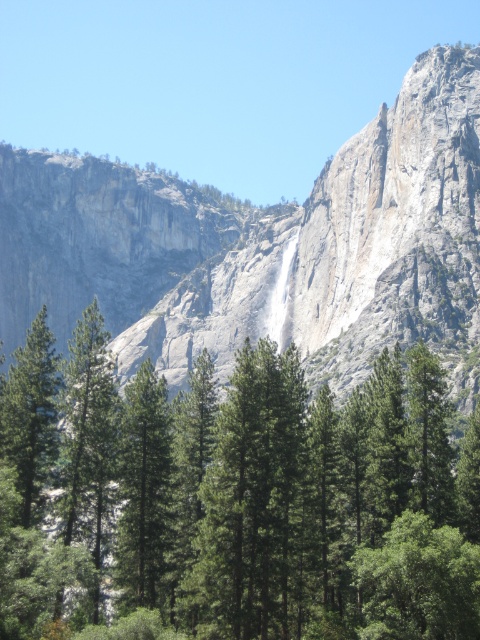
You are a GUI agent. You are given a task and a screenshot of the screen. Output one action in this format:
    pyautogui.click(x=<x>, y=<y>)
    Task: Click on the green textured pine trees at center
    
    Given the screenshot: What is the action you would take?
    pyautogui.click(x=236, y=497)

Between green textured pine trees at center and gray rock face at center, which one is positioned lower?

Positioned lower is green textured pine trees at center.

Where is `green textured pine trees at center`? This screenshot has width=480, height=640. green textured pine trees at center is located at coordinates (236, 497).